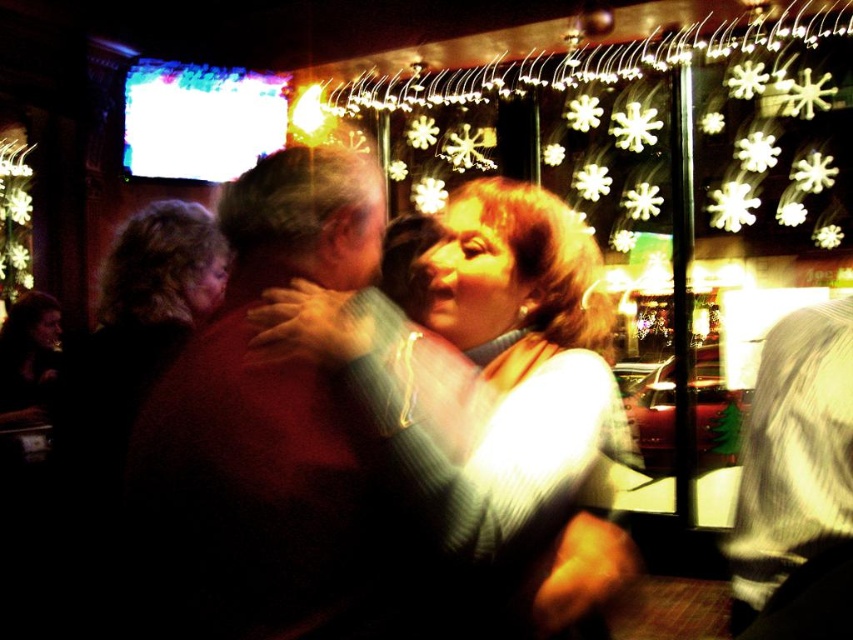
Question: Which point appears closest to the camera in this image?

Choices:
 (A) (390, 301)
 (B) (651, 122)
 (C) (784, 534)

Answer: (C)

Question: Which is nearer to the smooth dark brown shirt at center?

Choices:
 (A) illuminated plastic snowflake at upper center
 (B) matte green sweater at center

Answer: (B)

Question: Can you confirm if matte green sweater at center is positioned above smooth dark brown shirt at center?

Choices:
 (A) yes
 (B) no

Answer: (A)

Question: Is illuminated plastic snowflake at upper center below matte green sweater at center?

Choices:
 (A) no
 (B) yes

Answer: (A)

Question: Among these points, which one is farthest from the camera?

Choices:
 (A) 648,144
 (B) 782,572
 (C) 469,477

Answer: (A)

Question: Does matte green sweater at center lie behind smooth dark brown shirt at center?

Choices:
 (A) no
 (B) yes

Answer: (A)